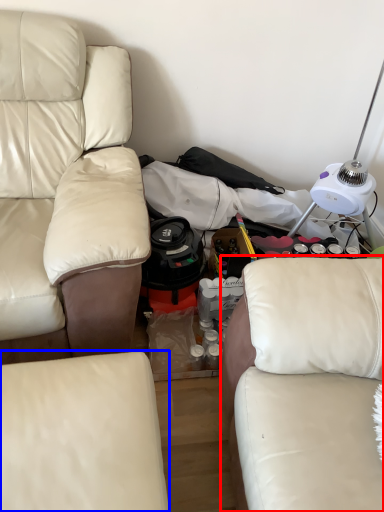
Question: Among these objects, which one is nearest to the camera, studio couch (highlighted by a red box) or studio couch (highlighted by a blue box)?

Choices:
 (A) studio couch
 (B) studio couch

Answer: (A)